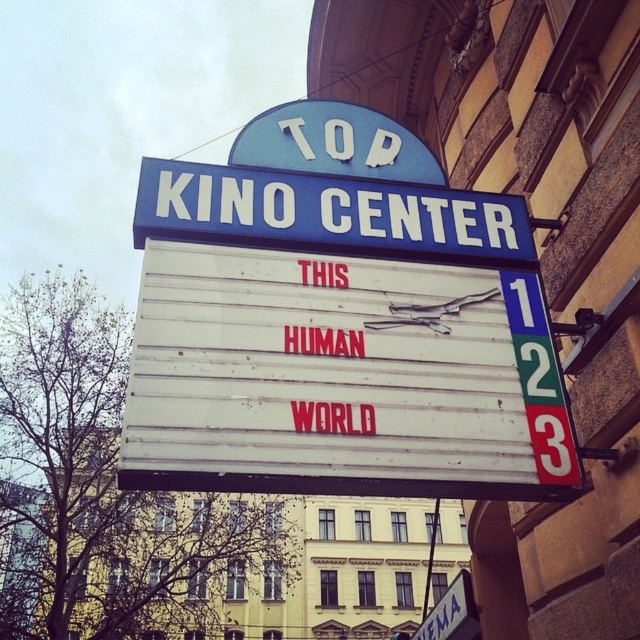
Question: Which point is closer to the camera?

Choices:
 (A) white plastic cinema sign at center
 (B) blue plastic marquee at center

Answer: (B)

Question: Can you confirm if blue plastic marquee at center is positioned to the right of white plastic cinema sign at center?

Choices:
 (A) no
 (B) yes

Answer: (A)

Question: Among these objects, which one is farthest from the camera?

Choices:
 (A) blue plastic marquee at center
 (B) white plastic cinema sign at center

Answer: (B)

Question: Where is blue plastic marquee at center located in relation to white plastic cinema sign at center in the image?

Choices:
 (A) above
 (B) below

Answer: (A)

Question: Is blue plastic marquee at center thinner than white plastic cinema sign at center?

Choices:
 (A) no
 (B) yes

Answer: (A)